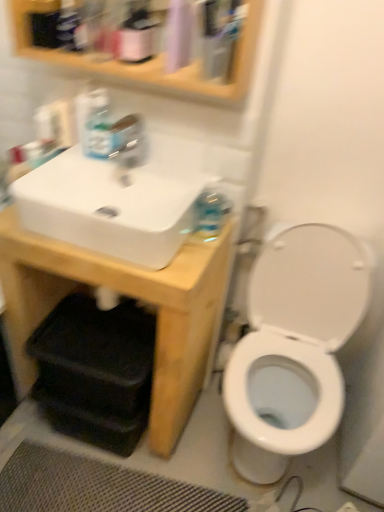
The image size is (384, 512). I want to click on free spot to the right of transparent plastic tap at upper center, so click(177, 172).